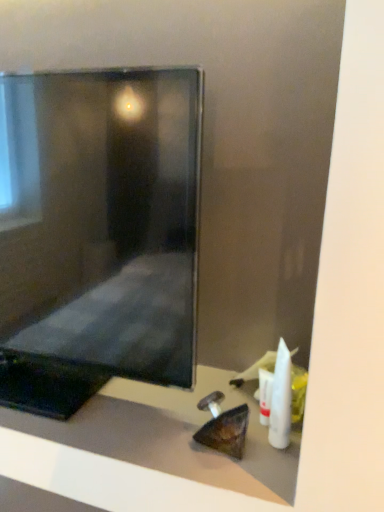
Question: Can you confirm if white plastic toothbrush at lower right, which ranks as the first toiletry in front-to-back order, is smaller than matte black monitor at center?

Choices:
 (A) yes
 (B) no

Answer: (A)

Question: Is white plastic toothbrush at lower right, which is the second toiletry in back-to-front order, positioned behind matte black monitor at center?

Choices:
 (A) no
 (B) yes

Answer: (B)

Question: Does white plastic toothbrush at lower right, which ranks as the first toiletry in front-to-back order, turn towards matte black monitor at center?

Choices:
 (A) yes
 (B) no

Answer: (B)

Question: Is white plastic toothbrush at lower right, which is the second toiletry in back-to-front order, taller than matte black monitor at center?

Choices:
 (A) yes
 (B) no

Answer: (B)

Question: Is white plastic toothbrush at lower right, which ranks as the first toiletry in front-to-back order, positioned with its back to matte black monitor at center?

Choices:
 (A) yes
 (B) no

Answer: (B)

Question: Is white plastic toothbrush at lower right, which ranks as the first toiletry in front-to-back order, wider or thinner than matte black monitor at center?

Choices:
 (A) wide
 (B) thin

Answer: (B)

Question: Is white plastic toothbrush at lower right, which ranks as the first toiletry in front-to-back order, bigger or smaller than matte black monitor at center?

Choices:
 (A) big
 (B) small

Answer: (B)

Question: Is white plastic toothbrush at lower right, which ranks as the first toiletry in front-to-back order, in front of or behind matte black monitor at center in the image?

Choices:
 (A) front
 (B) behind

Answer: (B)

Question: From a real-world perspective, relative to matte black monitor at center, is white plastic toothbrush at lower right, which is the second toiletry in back-to-front order, vertically above or below?

Choices:
 (A) below
 (B) above

Answer: (A)

Question: Based on their positions, is white plastic tube at lower right, placed as the 1th toiletry when sorted from back to front, located to the left or right of matte black monitor at center?

Choices:
 (A) right
 (B) left

Answer: (A)

Question: Is point (261, 392) positioned closer to the camera than point (150, 86)?

Choices:
 (A) closer
 (B) farther

Answer: (B)

Question: From a real-world perspective, is white plastic tube at lower right, placed as the 1th toiletry when sorted from back to front, positioned above or below matte black monitor at center?

Choices:
 (A) above
 (B) below

Answer: (B)

Question: In terms of size, does white plastic tube at lower right, placed as the 1th toiletry when sorted from back to front, appear bigger or smaller than matte black monitor at center?

Choices:
 (A) big
 (B) small

Answer: (B)

Question: Is white plastic tube at lower right, placed as the 1th toiletry when sorted from back to front, bigger or smaller than matte black monitor at center?

Choices:
 (A) big
 (B) small

Answer: (B)

Question: In terms of height, does white plastic tube at lower right, placed as the 1th toiletry when sorted from back to front, look taller or shorter compared to matte black monitor at center?

Choices:
 (A) tall
 (B) short

Answer: (B)